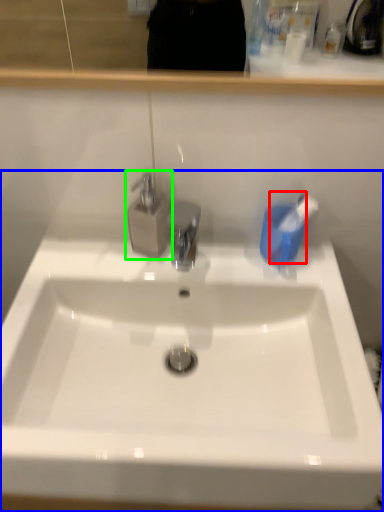
Question: Which object is positioned farthest from toothbrush (highlighted by a red box)? Select from sink (highlighted by a blue box) and tap (highlighted by a green box).

Choices:
 (A) sink
 (B) tap

Answer: (A)